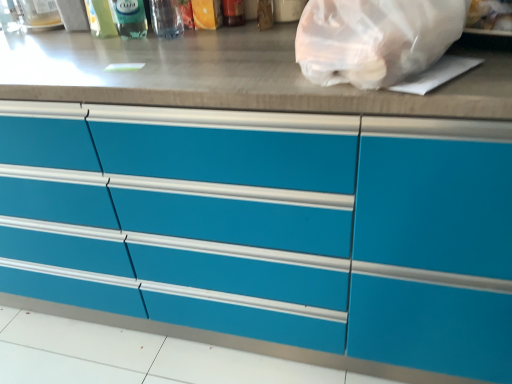
The width and height of the screenshot is (512, 384). In order to click on empty space that is ontop of matte blue drawers at center in this screenshot , I will do `click(169, 46)`.